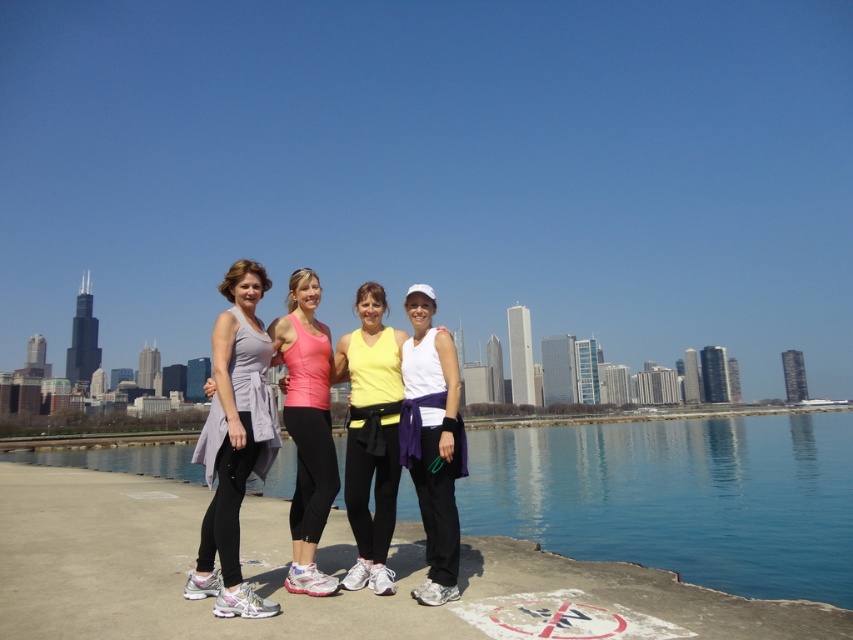
Who is more distant from viewer, (x=669, y=433) or (x=355, y=307)?

Positioned behind is point (x=669, y=433).

Who is positioned more to the left, blue water at lower center or matte yellow tank top at center?

matte yellow tank top at center is more to the left.

Is point (804, 540) closer to viewer compared to point (381, 593)?

No.

Identify the location of blue water at lower center. Image resolution: width=853 pixels, height=640 pixels. (679, 497).

Can you confirm if blue water at lower center is bigger than matte gray tank top at center?

Correct, blue water at lower center is larger in size than matte gray tank top at center.

Who is more distant from viewer, (833, 557) or (294, 339)?

Point (833, 557)

Who is more distant from viewer, (579, 520) or (306, 300)?

The point (579, 520) is behind.

Where is `blue water at lower center`? This screenshot has width=853, height=640. blue water at lower center is located at coordinates (679, 497).

This screenshot has width=853, height=640. Describe the element at coordinates (679, 497) in the screenshot. I see `blue water at lower center` at that location.

Who is positioned more to the right, blue water at lower center or white matte tank top at center?

Positioned to the right is blue water at lower center.

The height and width of the screenshot is (640, 853). I want to click on blue water at lower center, so click(x=679, y=497).